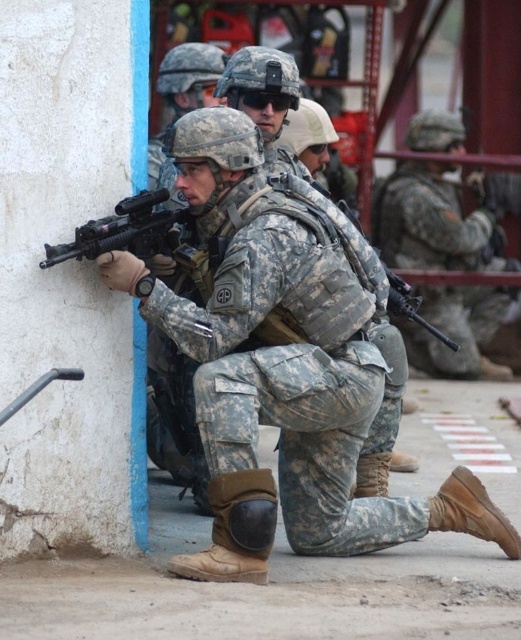
Question: Can you confirm if camouflage uniform at center is thinner than matte black rifle at left?

Choices:
 (A) yes
 (B) no

Answer: (B)

Question: Can you confirm if camouflage uniform at center is wider than matte black rifle at left?

Choices:
 (A) no
 (B) yes

Answer: (B)

Question: Which of the following is the closest to the observer?

Choices:
 (A) (146, 262)
 (B) (495, 220)

Answer: (A)

Question: Does camouflage uniform at center come behind matte black rifle at left?

Choices:
 (A) no
 (B) yes

Answer: (B)

Question: Which object is farther from the camera taking this photo?

Choices:
 (A) camouflage uniform at center
 (B) matte black rifle at left

Answer: (A)